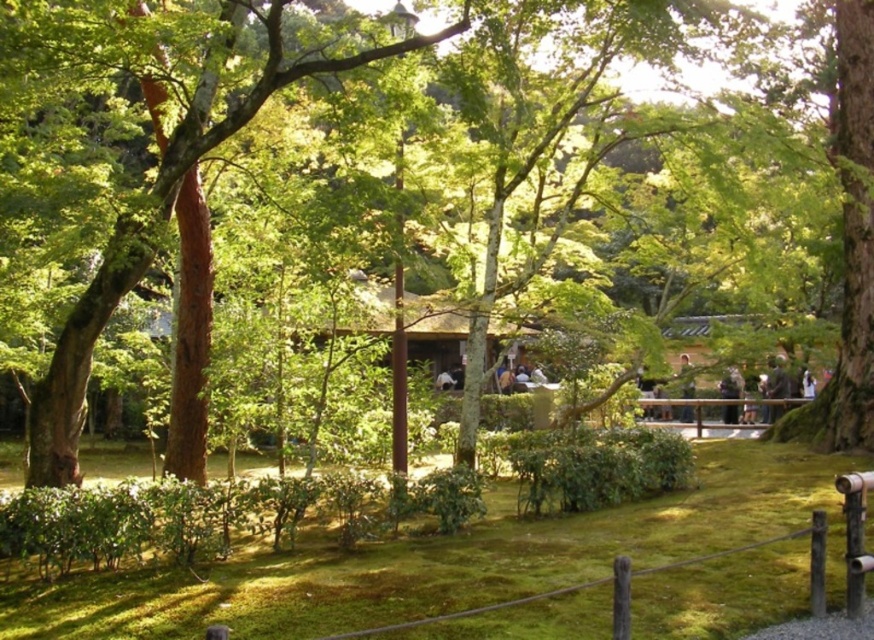
Who is shorter, dark gray fabric jacket at lower right or light brown wooden post at center?

Standing shorter between the two is light brown wooden post at center.

What do you see at coordinates (732, 384) in the screenshot? The image size is (874, 640). I see `dark gray fabric jacket at lower right` at bounding box center [732, 384].

Does point (729, 420) lie in front of point (694, 387)?

That is True.

This screenshot has height=640, width=874. I want to click on dark gray fabric jacket at lower right, so click(732, 384).

Does dark gray fabric jacket at lower right have a lesser height compared to white matte person at upper right?

Yes.

Which of these two, dark gray fabric jacket at lower right or white matte person at upper right, stands shorter?

dark gray fabric jacket at lower right

Describe the element at coordinates (732, 384) in the screenshot. This screenshot has height=640, width=874. I see `dark gray fabric jacket at lower right` at that location.

At what (x,y) coordinates should I click in order to perform the action: click on dark gray fabric jacket at lower right. Please return your answer as a coordinate pair (x, y). Looking at the image, I should click on (732, 384).

Who is more distant from viewer, (x=26, y=624) or (x=649, y=413)?

Point (x=649, y=413)

What do you see at coordinates (448, 560) in the screenshot?
I see `green mossy grass at center` at bounding box center [448, 560].

Locate an element on the screen. This screenshot has width=874, height=640. green mossy grass at center is located at coordinates (448, 560).